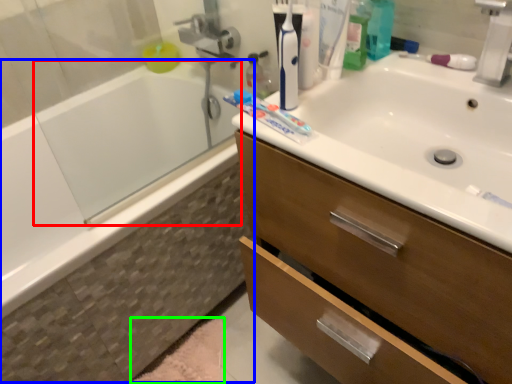
Question: Based on their relative distances, which object is nearer to bath (highlighted by a red box)? Choose from bath (highlighted by a blue box) and bath mat (highlighted by a green box).

Choices:
 (A) bath
 (B) bath mat

Answer: (A)